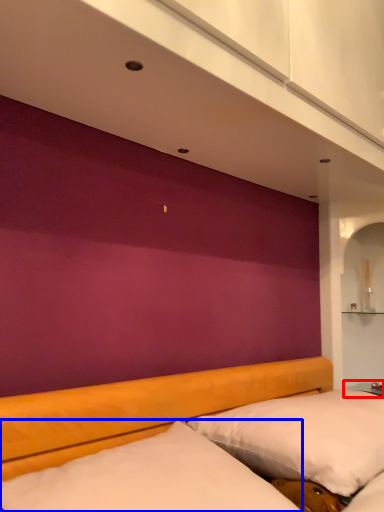
Question: Which of the following is the farthest to the observer, table (highlighted by a red box) or mattress (highlighted by a blue box)?

Choices:
 (A) table
 (B) mattress

Answer: (A)